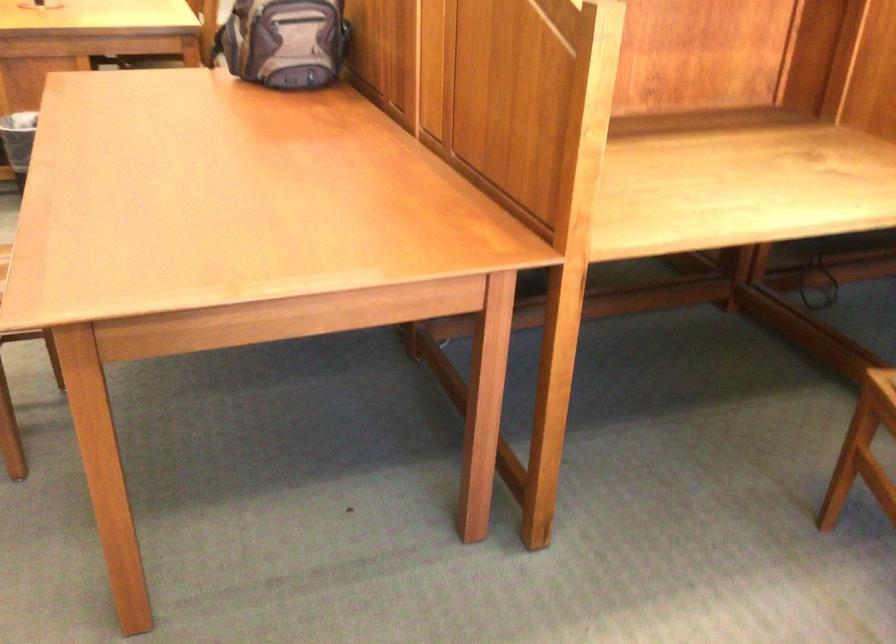
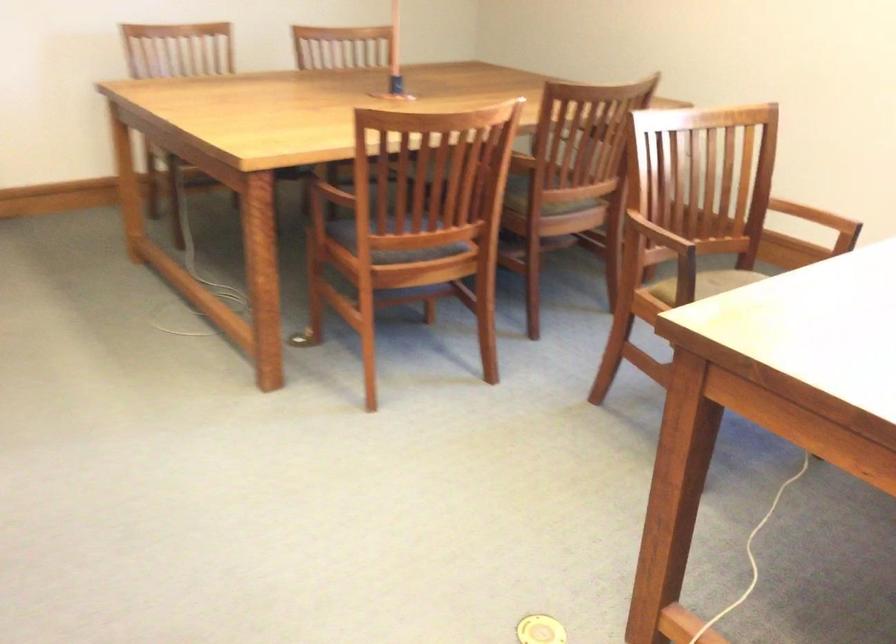
How did the camera likely rotate?

The rotation direction of the camera is right-down.